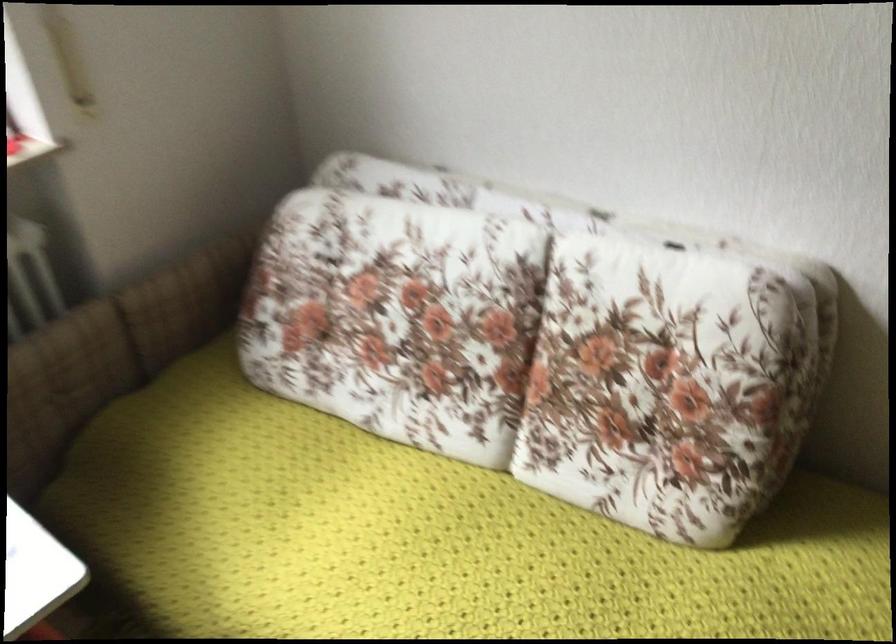
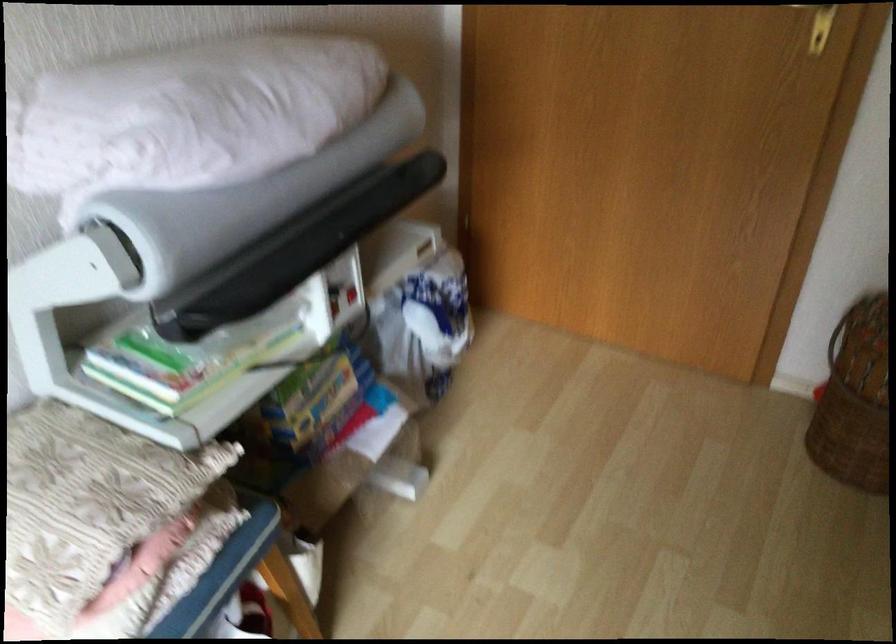
The images are taken continuously from a first-person perspective. In which direction is your viewpoint rotating?

The camera's rotation is toward right-down.